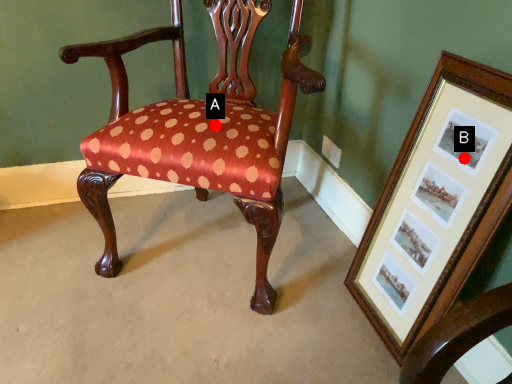
Question: Two points are circled on the image, labeled by A and B beside each circle. Which of the following is the farthest from the observer?

Choices:
 (A) A is further
 (B) B is further

Answer: (A)